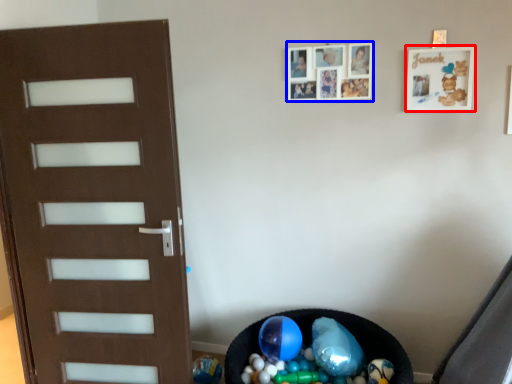
Question: Which object is further to the camera taking this photo, picture frame (highlighted by a red box) or picture frame (highlighted by a blue box)?

Choices:
 (A) picture frame
 (B) picture frame

Answer: (B)